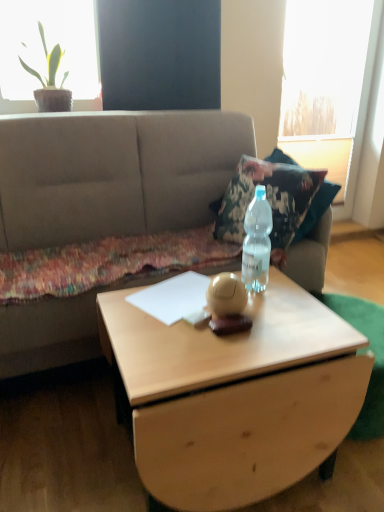
Identify the location of free region on the left part of light wood coffee table at center. (64, 441).